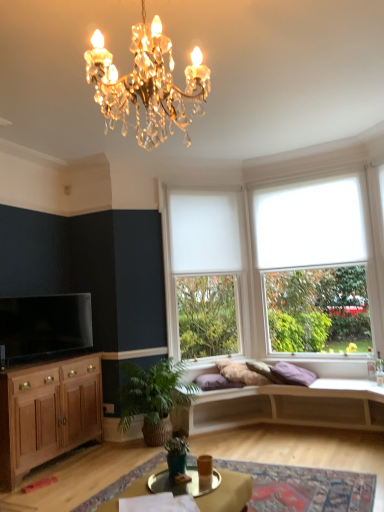
Question: Would you say metallic silver cocktail table at center is part of white matte studio couch at center's contents?

Choices:
 (A) no
 (B) yes

Answer: (A)

Question: From a real-world perspective, is white matte studio couch at center physically below metallic silver cocktail table at center?

Choices:
 (A) no
 (B) yes

Answer: (B)

Question: From a real-world perspective, is white matte studio couch at center on top of metallic silver cocktail table at center?

Choices:
 (A) yes
 (B) no

Answer: (B)

Question: Does white matte studio couch at center appear on the right side of metallic silver cocktail table at center?

Choices:
 (A) no
 (B) yes

Answer: (B)

Question: Is white matte studio couch at center far from metallic silver cocktail table at center?

Choices:
 (A) no
 (B) yes

Answer: (B)

Question: Is white matte studio couch at center aimed at metallic silver cocktail table at center?

Choices:
 (A) no
 (B) yes

Answer: (B)

Question: Can you confirm if white matte blind at upper center is wider than black glossy television at left?

Choices:
 (A) no
 (B) yes

Answer: (A)

Question: Would you say black glossy television at left is part of white matte blind at upper center's contents?

Choices:
 (A) yes
 (B) no

Answer: (B)

Question: Considering the relative positions of white matte blind at upper center and black glossy television at left in the image provided, is white matte blind at upper center in front of black glossy television at left?

Choices:
 (A) no
 (B) yes

Answer: (A)

Question: Considering the relative sizes of white matte blind at upper center and black glossy television at left in the image provided, is white matte blind at upper center bigger than black glossy television at left?

Choices:
 (A) no
 (B) yes

Answer: (A)

Question: Is white matte blind at upper center not inside black glossy television at left?

Choices:
 (A) yes
 (B) no

Answer: (A)

Question: Is the position of white matte blind at upper center more distant than that of black glossy television at left?

Choices:
 (A) no
 (B) yes

Answer: (B)

Question: Does white roller blind at right lie in front of white matte studio couch at center?

Choices:
 (A) yes
 (B) no

Answer: (B)